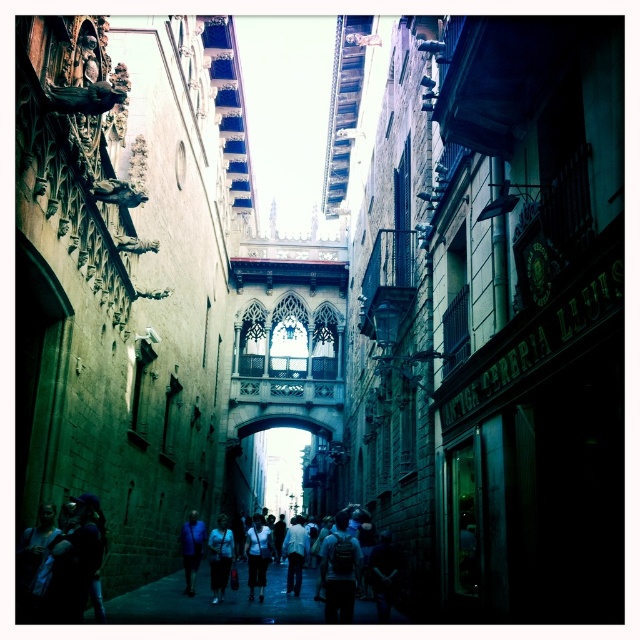
Question: Can you confirm if dark blue jeans at center is wider than dark gray backpack at center?

Choices:
 (A) no
 (B) yes

Answer: (B)

Question: Can you confirm if dark blue jeans at center is positioned above matte white shirt at center?

Choices:
 (A) yes
 (B) no

Answer: (B)

Question: Which of the following is the farthest from the observer?

Choices:
 (A) dark gray backpack at center
 (B) blue fabric shirt at center
 (C) transparent glass archway at center

Answer: (C)

Question: Considering the real-world distances, which object is farthest from the white cotton shirt at center?

Choices:
 (A) matte white shirt at center
 (B) white matte shirt at center
 (C) transparent glass archway at center

Answer: (C)

Question: Can you confirm if transparent glass archway at center is thinner than blue fabric shirt at center?

Choices:
 (A) yes
 (B) no

Answer: (B)

Question: Among these points, which one is nearest to the camera?

Choices:
 (A) (260, 561)
 (B) (301, 516)
 (C) (397, 621)
 (D) (324, 616)

Answer: (D)